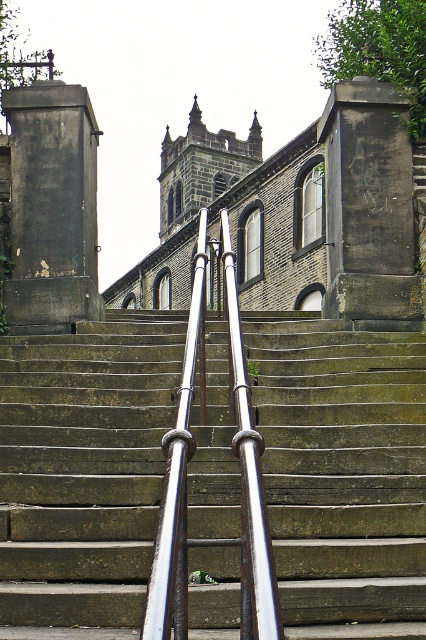
Between rusty metal stairs at center and silver metallic handrail at center, which one is positioned higher?

Positioned higher is silver metallic handrail at center.

Is rusty metal stairs at center smaller than silver metallic handrail at center?

No.

Identify the location of rusty metal stairs at center. This screenshot has width=426, height=640. (342, 472).